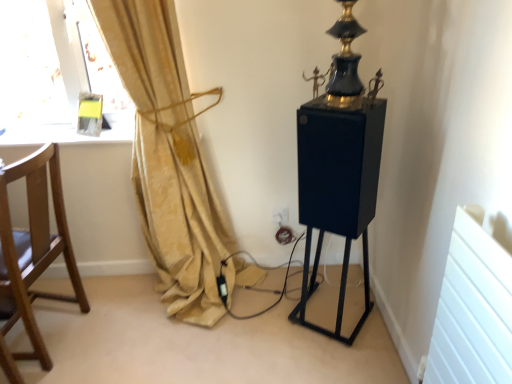
Question: Does matte glass window sill at upper left have a smaller size compared to white plastic electric outlet at center?

Choices:
 (A) yes
 (B) no

Answer: (B)

Question: Is matte glass window sill at upper left closer to camera compared to white plastic electric outlet at center?

Choices:
 (A) yes
 (B) no

Answer: (A)

Question: Is matte glass window sill at upper left beside white plastic electric outlet at center?

Choices:
 (A) no
 (B) yes

Answer: (A)

Question: Can white plastic electric outlet at center be found inside matte glass window sill at upper left?

Choices:
 (A) no
 (B) yes

Answer: (A)

Question: Can you confirm if matte glass window sill at upper left is shorter than white plastic electric outlet at center?

Choices:
 (A) yes
 (B) no

Answer: (A)

Question: Is matte glass window sill at upper left not inside white plastic electric outlet at center?

Choices:
 (A) no
 (B) yes

Answer: (B)

Question: From a real-world perspective, is gold fabric curtain at left physically below wooden chair at left?

Choices:
 (A) yes
 (B) no

Answer: (B)

Question: Does gold fabric curtain at left appear on the right side of wooden chair at left?

Choices:
 (A) no
 (B) yes

Answer: (B)

Question: From a real-world perspective, is gold fabric curtain at left positioned over wooden chair at left based on gravity?

Choices:
 (A) yes
 (B) no

Answer: (A)

Question: Is the depth of gold fabric curtain at left greater than that of wooden chair at left?

Choices:
 (A) no
 (B) yes

Answer: (A)

Question: Is gold fabric curtain at left not near wooden chair at left?

Choices:
 (A) yes
 (B) no

Answer: (B)

Question: Is gold fabric curtain at left oriented towards wooden chair at left?

Choices:
 (A) yes
 (B) no

Answer: (B)

Question: Would you say gold fabric curtain at left is a long distance from matte glass window sill at upper left?

Choices:
 (A) no
 (B) yes

Answer: (A)